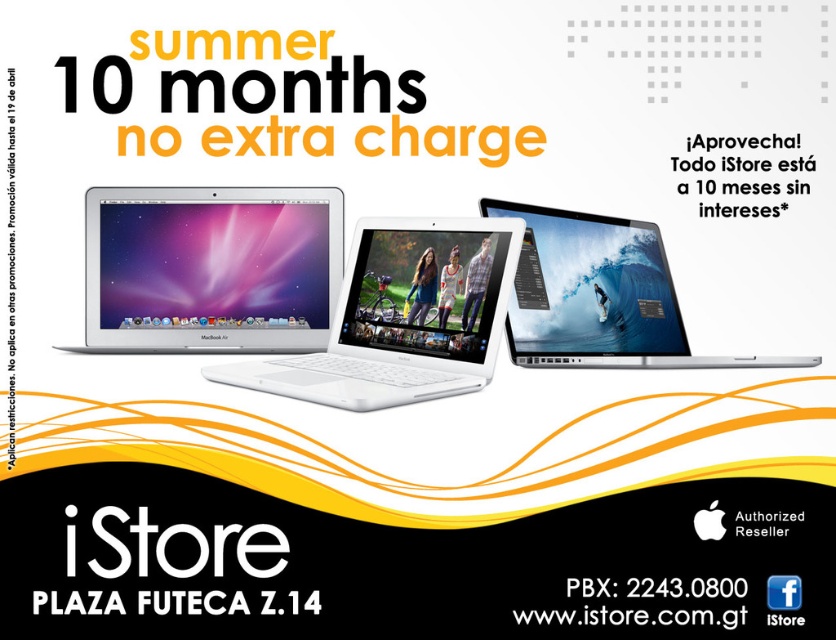
You are a customer standing in front of the iStore advertisement. You want to locate the satin silver macbook air at center. Based on the coordinates provided, where exactly is it positioned in the image?

The satin silver macbook air at center is positioned at point 0.420 along the horizontal axis and 0.252 along the vertical axis in the image.

You are a customer looking at the iStore advertisement. You see the satin silver macbook air at center and the white glossy laptop at center. Which MacBook is placed higher in the image?

The satin silver macbook air at center is positioned over the white glossy laptop at center, so it is placed higher in the image.